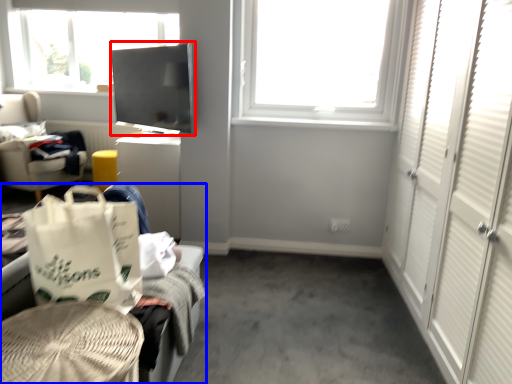
Question: Among these objects, which one is nearest to the camera, window screen (highlighted by a red box) or furniture (highlighted by a blue box)?

Choices:
 (A) window screen
 (B) furniture

Answer: (B)